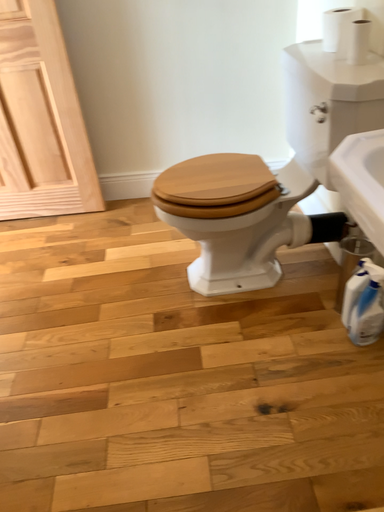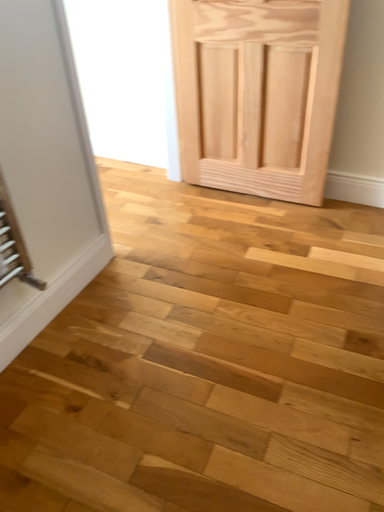
Question: How did the camera likely rotate when shooting the video?

Choices:
 (A) rotated right
 (B) rotated left

Answer: (B)